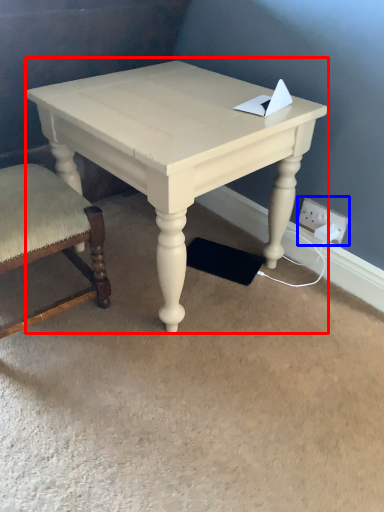
Question: Which object is further to the camera taking this photo, table (highlighted by a red box) or electric outlet (highlighted by a blue box)?

Choices:
 (A) table
 (B) electric outlet

Answer: (B)